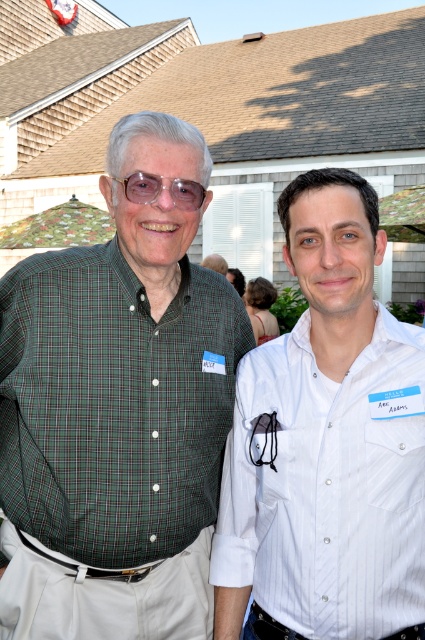
Between white pinstripe shirt at center and transparent plastic glasses at center, which one appears on the left side from the viewer's perspective?

From the viewer's perspective, transparent plastic glasses at center appears more on the left side.

At what (x,y) coordinates should I click in order to perform the action: click on white pinstripe shirt at center. Please return your answer as a coordinate pair (x, y). This screenshot has height=640, width=425. Looking at the image, I should click on (328, 484).

Identify the location of white pinstripe shirt at center. The image size is (425, 640). (328, 484).

Which is behind, point (189, 392) or point (180, 195)?

Positioned behind is point (189, 392).

Who is lower down, green plaid shirt at left or transparent plastic glasses at center?

green plaid shirt at left is below.

The height and width of the screenshot is (640, 425). I want to click on green plaid shirt at left, so click(116, 413).

Which is more to the left, green plaid shirt at left or white pinstripe shirt at center?

Positioned to the left is green plaid shirt at left.

Locate an element on the screen. The height and width of the screenshot is (640, 425). green plaid shirt at left is located at coordinates (116, 413).